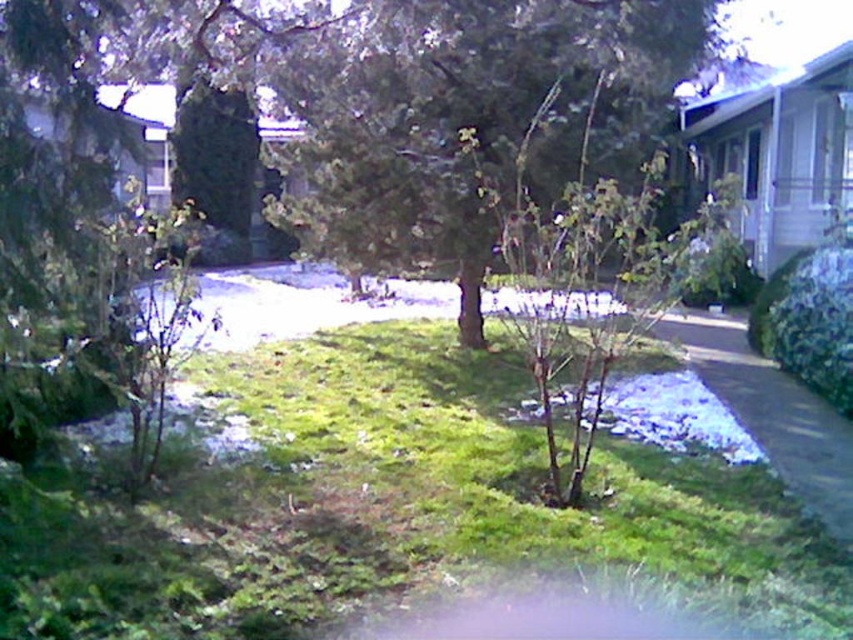
Is green grass at center to the right of green textured tree at center from the viewer's perspective?

In fact, green grass at center is to the left of green textured tree at center.

Is the position of green grass at center less distant than that of green textured tree at center?

That is True.

Between point (62, 598) and point (650, 74), which one is positioned in front?

Point (62, 598)

Locate an element on the screen. green grass at center is located at coordinates (393, 509).